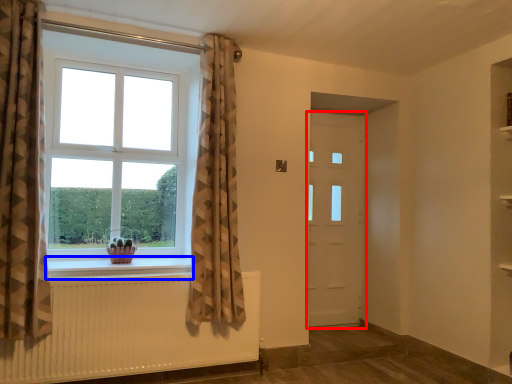
Question: Which point is closer to the camera, door (highlighted by a red box) or window sill (highlighted by a blue box)?

Choices:
 (A) door
 (B) window sill

Answer: (B)